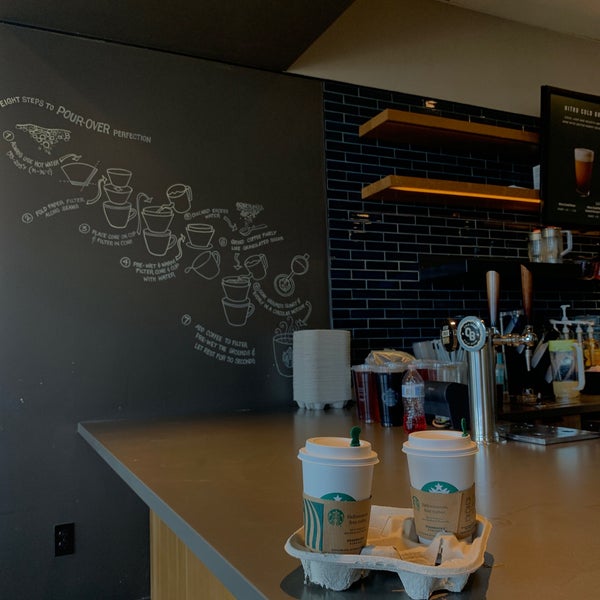
This screenshot has height=600, width=600. I want to click on grey countertop, so click(x=225, y=483).